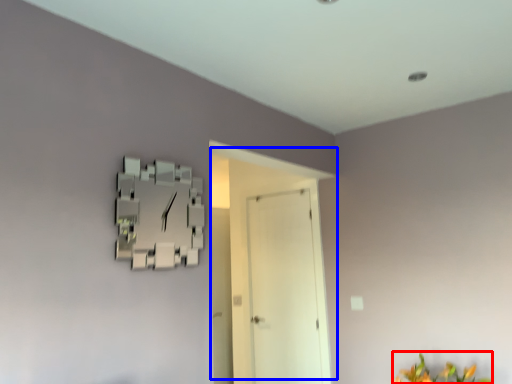
Question: Which point is further to the camera, flower (highlighted by a red box) or door (highlighted by a blue box)?

Choices:
 (A) flower
 (B) door

Answer: (B)